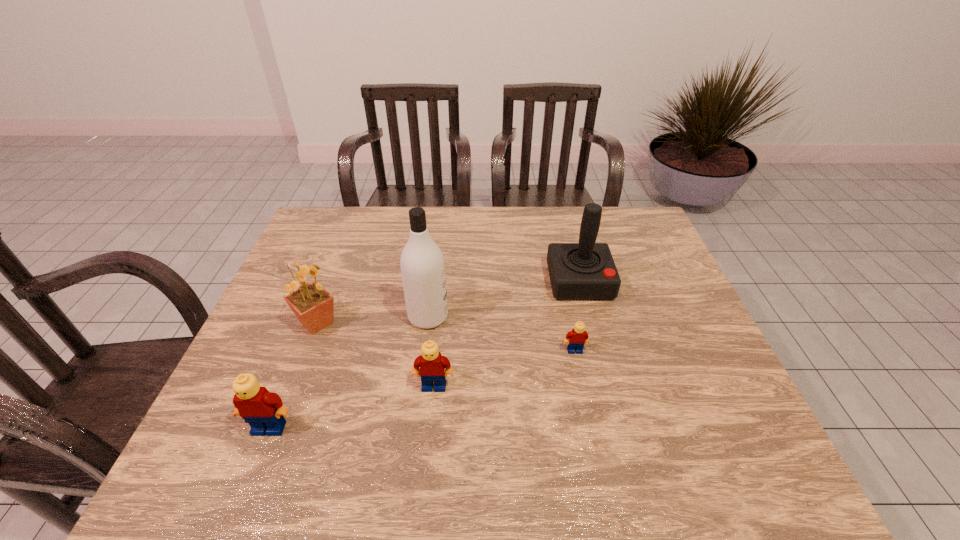
You are a GUI agent. You are given a task and a screenshot of the screen. Output one action in this format:
    pyautogui.click(x=<x>, y=<y>)
    Task: Click on the vacant region at the left edge of the desktop
    
    Given the screenshot: What is the action you would take?
    pyautogui.click(x=324, y=252)

The image size is (960, 540). In order to click on vacant space at the right edge of the desktop in this screenshot , I will do (x=673, y=269).

Find the location of a particular element. vacant space at the far right corner is located at coordinates (622, 222).

The height and width of the screenshot is (540, 960). In the image, there is a desktop. In order to click on vacant space at the near right corner in this screenshot , I will do `click(715, 433)`.

The height and width of the screenshot is (540, 960). I want to click on free spot between the shampoo and the joystick, so click(x=504, y=299).

What are the coordinates of `unoccupied area between the farthest Lego and the third tallest object` in the screenshot? It's located at (446, 336).

Locate an element on the screen. free space between the second Lego from left to right and the nearest Lego is located at coordinates (351, 407).

I want to click on vacant space that's between the shampoo and the joystick, so click(x=504, y=299).

Identify the location of free area in between the sunflower and the second Lego from right to left. [375, 354].

You are a GUI agent. You are given a task and a screenshot of the screen. Output one action in this format:
    pyautogui.click(x=<x>, y=<y>)
    Task: Click on the unoccupied position between the shampoo and the rightmost Lego
    
    Given the screenshot: What is the action you would take?
    pyautogui.click(x=501, y=334)